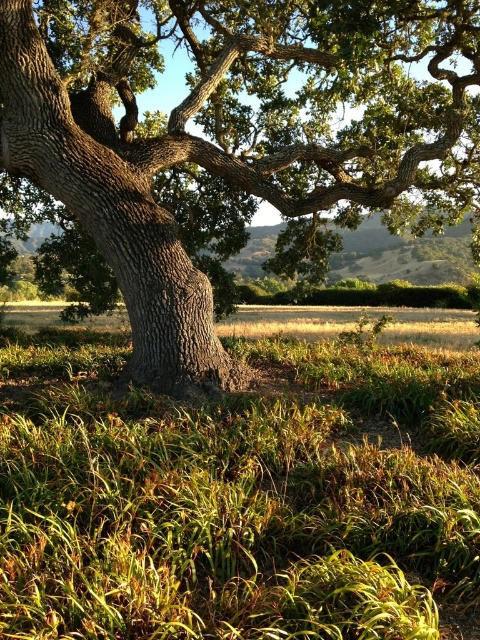
Question: Where is green grass at center located in relation to smooth bark oak tree at center in the image?

Choices:
 (A) above
 (B) below

Answer: (B)

Question: Does green grass at center have a lesser width compared to smooth bark oak tree at center?

Choices:
 (A) yes
 (B) no

Answer: (A)

Question: Which of the following is the farthest from the observer?

Choices:
 (A) (383, 49)
 (B) (35, 516)

Answer: (A)

Question: Which point is farther to the camera?

Choices:
 (A) green grass at center
 (B) smooth bark oak tree at center

Answer: (B)

Question: Which of the following is the farthest from the observer?

Choices:
 (A) green grass at center
 (B) smooth bark oak tree at center

Answer: (B)

Question: Is green grass at center thinner than smooth bark oak tree at center?

Choices:
 (A) no
 (B) yes

Answer: (B)